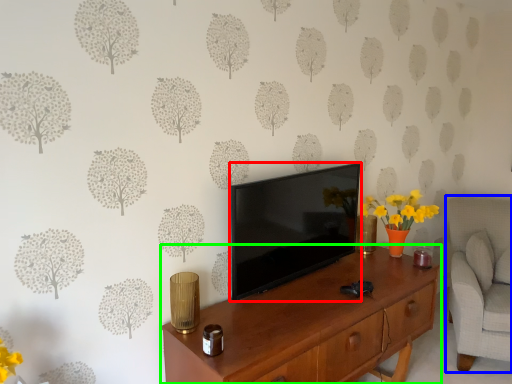
Question: Which is nearer to the television (highlighted by a red box)? swivel chair (highlighted by a blue box) or desk (highlighted by a green box).

Choices:
 (A) swivel chair
 (B) desk

Answer: (B)